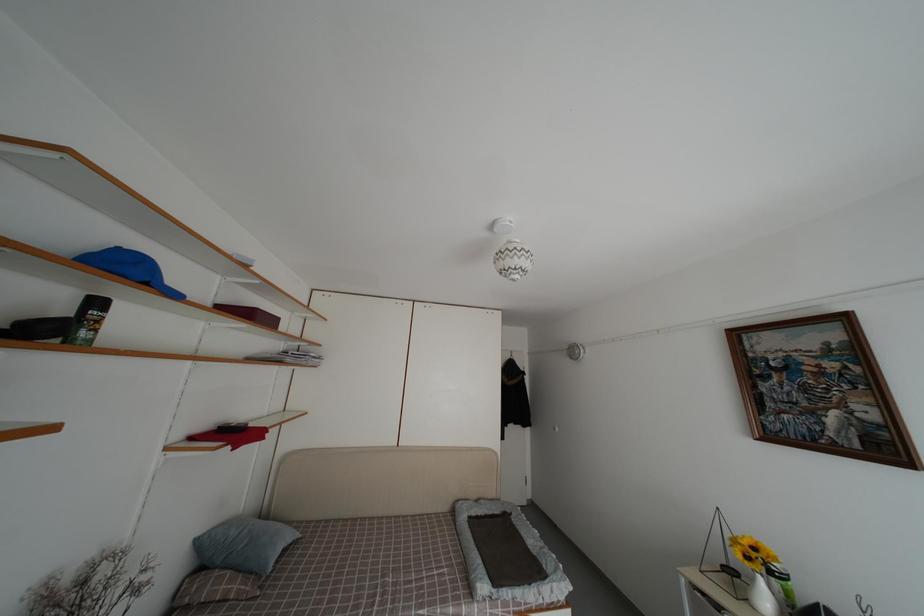
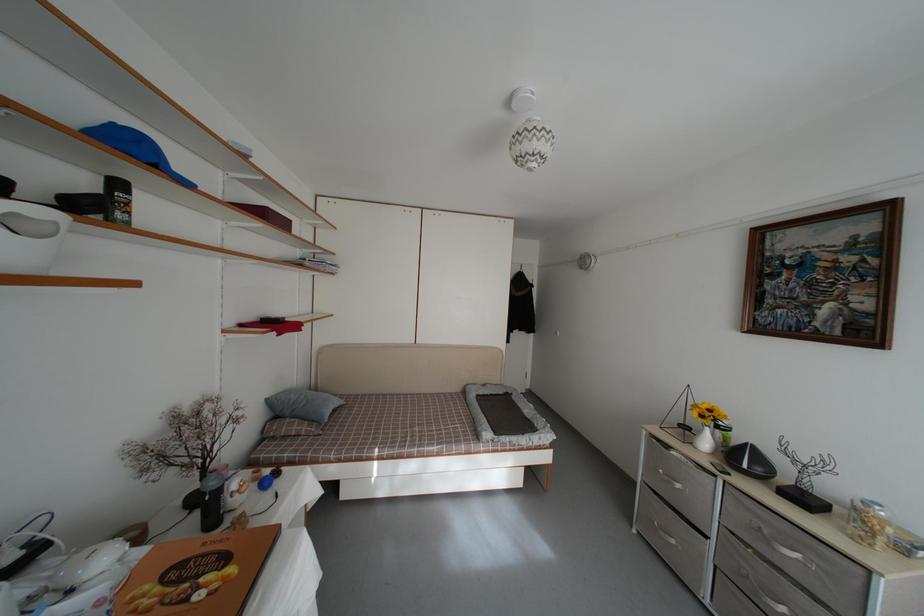
In the second image, find the point that corresponds to the point at 74,586 in the first image.

(192, 416)